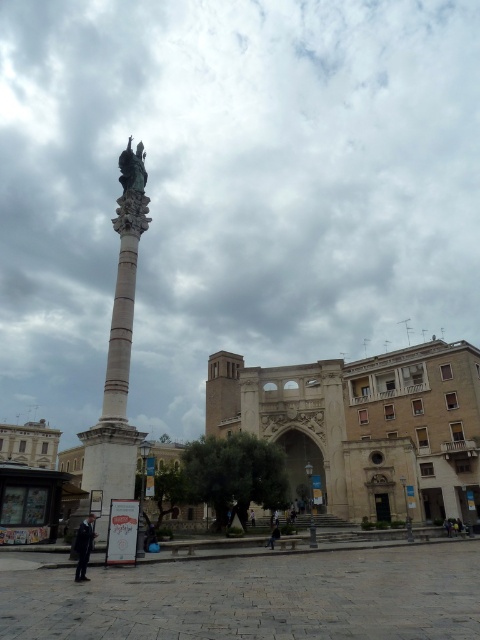
You are a photographer standing in the square and want to capture both the bronze statue at center and the white cotton shirt at center in the same frame. Which object should you focus on first to ensure both are in focus?

The bronze statue at center is positioned over the white cotton shirt at center, so focusing on the statue will ensure both are in focus as the shirt is behind it.

You are standing in the urban square and want to take a photo of the white marble column at center. If your camera can focus on objects up to 50 feet away, will you need to move closer to get a clear shot?

The white marble column at center is 56.94 feet away from you, which exceeds your camera maximum focus range of 50 feet. You need to move closer to ensure the column is within the 50 feet range for clear focus.